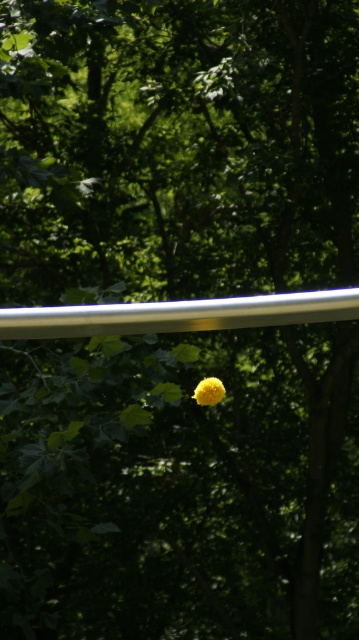
You are a bird perched on the silver metallic rail at upper center and want to fly down to the yellow fuzzy ball at center. Can you reach it without flapping your wings?

The silver metallic rail at upper center is taller than the yellow fuzzy ball at center, so yes, the bird can glide down to the yellow fuzzy ball at center since it is lower than the rail.